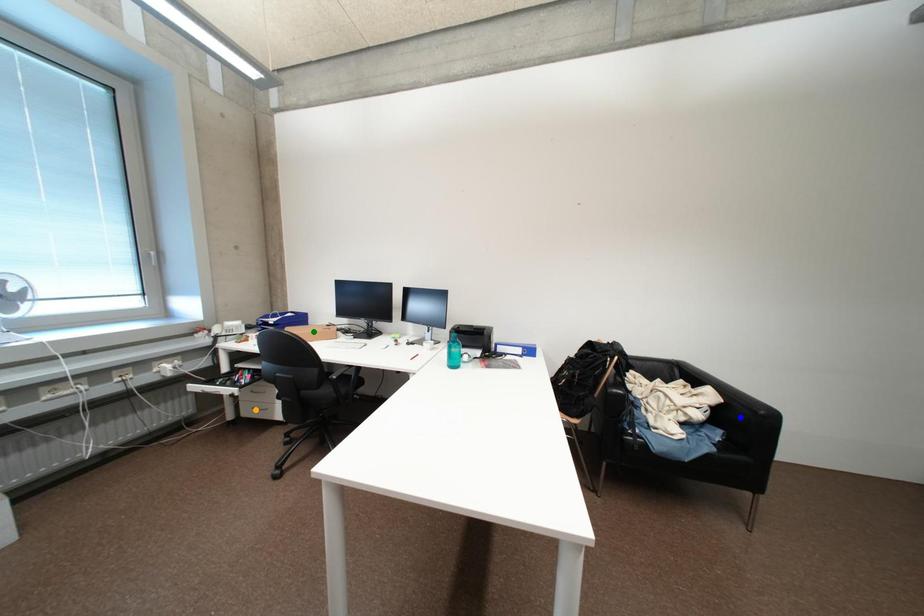
Order these from nearest to farthest:
1. orange point
2. green point
3. blue point

blue point
orange point
green point